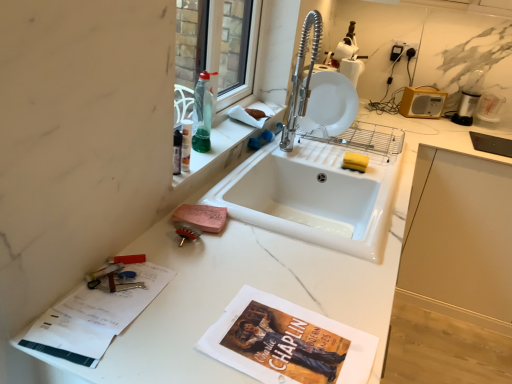
Question: From a real-world perspective, is transparent glass window at upper center above or below white marble countertop at center?

Choices:
 (A) above
 (B) below

Answer: (A)

Question: Is transparent glass window at upper center in front of or behind white marble countertop at center in the image?

Choices:
 (A) behind
 (B) front

Answer: (A)

Question: Which object is positioned closest to the transparent glass window at upper center?

Choices:
 (A) white plastic radio at upper right
 (B) white glossy plate at upper center
 (C) white marble countertop at center
 (D) translucent green liquid at sink left

Answer: (D)

Question: Which object is the closest to the white plastic radio at upper right?

Choices:
 (A) translucent green liquid at sink left
 (B) white marble countertop at center
 (C) transparent glass window at upper center
 (D) white glossy plate at upper center

Answer: (D)